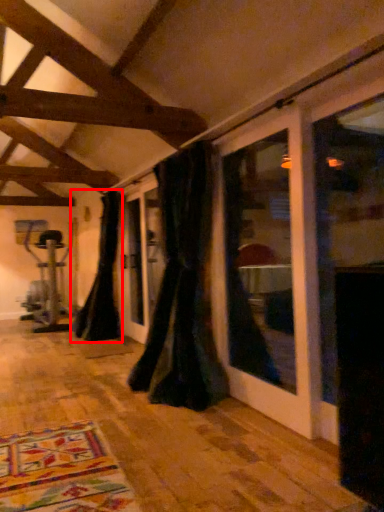
Question: From the image's perspective, what is the correct spatial relationship of curtain (annotated by the red box) in relation to curtain?

Choices:
 (A) below
 (B) above

Answer: (A)